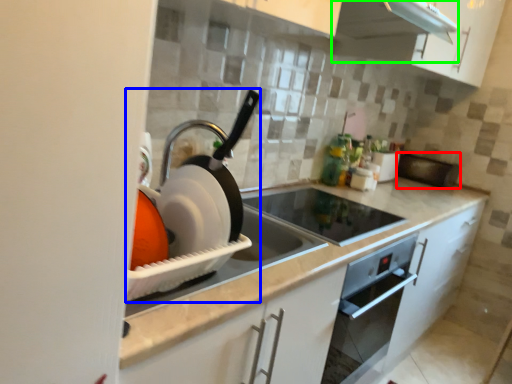
Question: Considering the real-world distances, which object is closest to appliance (highlighted by a red box)? appliance (highlighted by a blue box) or exhaust hood (highlighted by a green box).

Choices:
 (A) appliance
 (B) exhaust hood

Answer: (B)